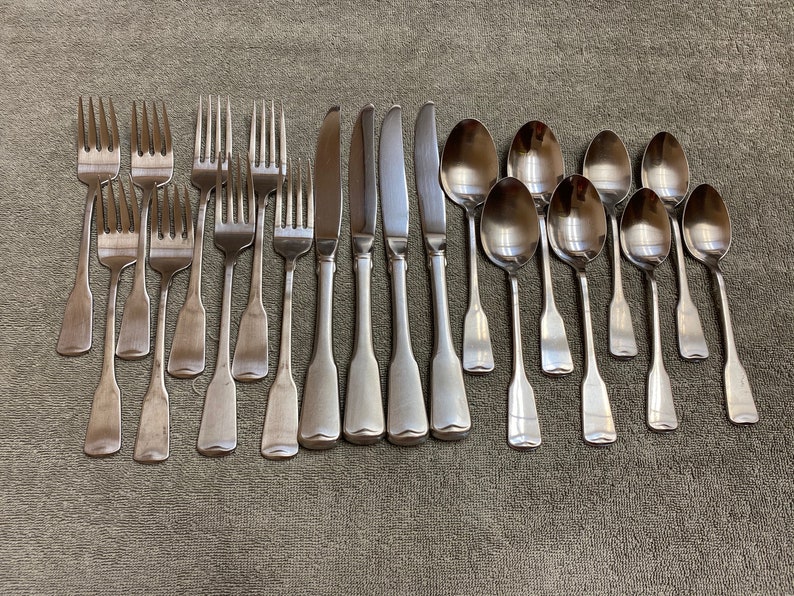
The image size is (794, 596). Identify the location of bowls of spoon. (513, 219), (576, 224), (649, 226), (704, 226), (672, 170), (611, 164), (548, 164), (465, 161).